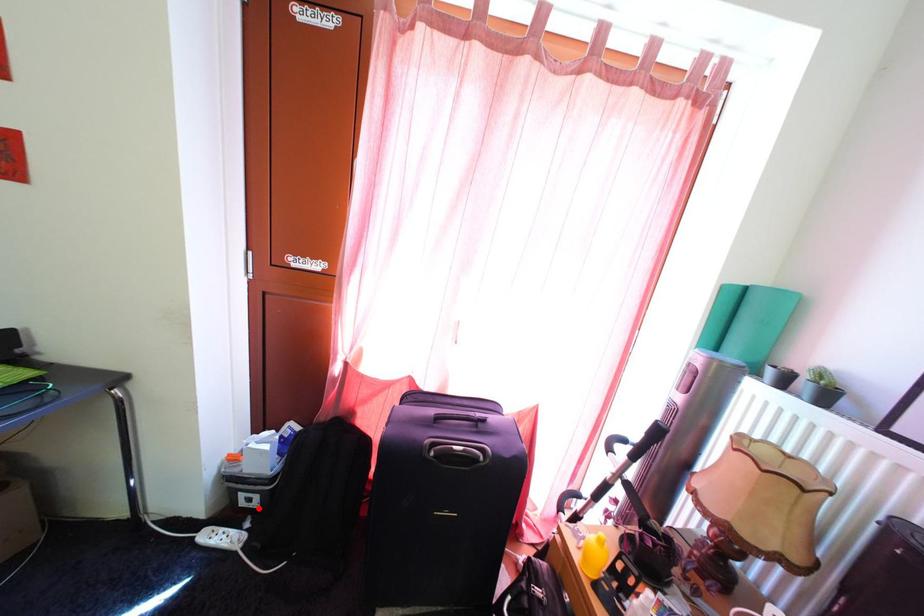
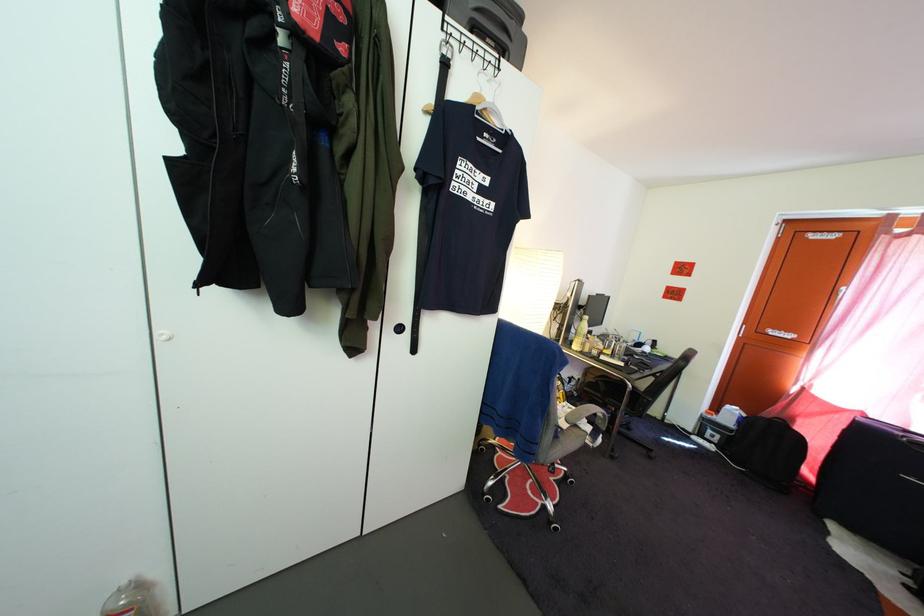
Question: I am providing you with two images of the same scene from different viewpoints. Given a red point in image1, look at the same physical point in image2. Is it:

Choices:
 (A) Closer to the viewpoint
 (B) Farther from the viewpoint

Answer: (B)